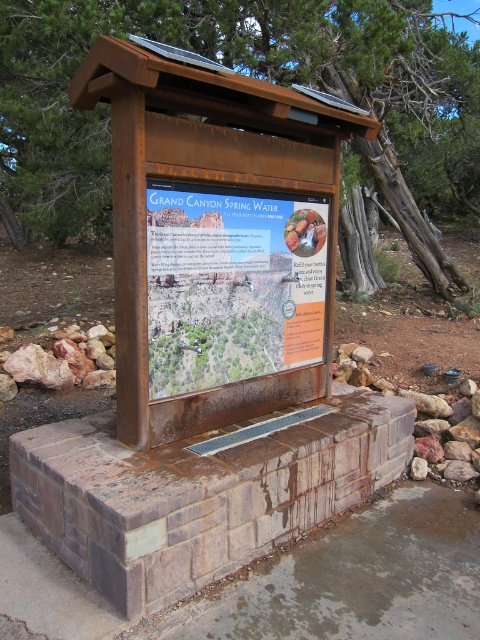
Question: From the image, what is the correct spatial relationship of rusty wood sign at center in relation to rustic wood sign at center?

Choices:
 (A) above
 (B) below

Answer: (A)

Question: Which point is farther from the camera taking this photo?

Choices:
 (A) (194, 220)
 (B) (147, 445)
 (C) (14, 0)

Answer: (C)

Question: Does rusty wood sign at upper center lie in front of rustic wood sign at center?

Choices:
 (A) yes
 (B) no

Answer: (B)

Question: Based on their relative distances, which object is farther from the rusty wood sign at upper center?

Choices:
 (A) rusty wood sign at center
 (B) rustic wood sign at center

Answer: (B)

Question: Which is farther from the rusty wood sign at center?

Choices:
 (A) rustic wood sign at center
 (B) rusty wood sign at upper center

Answer: (B)

Question: Is the position of rusty wood sign at center more distant than that of rustic wood sign at center?

Choices:
 (A) yes
 (B) no

Answer: (B)